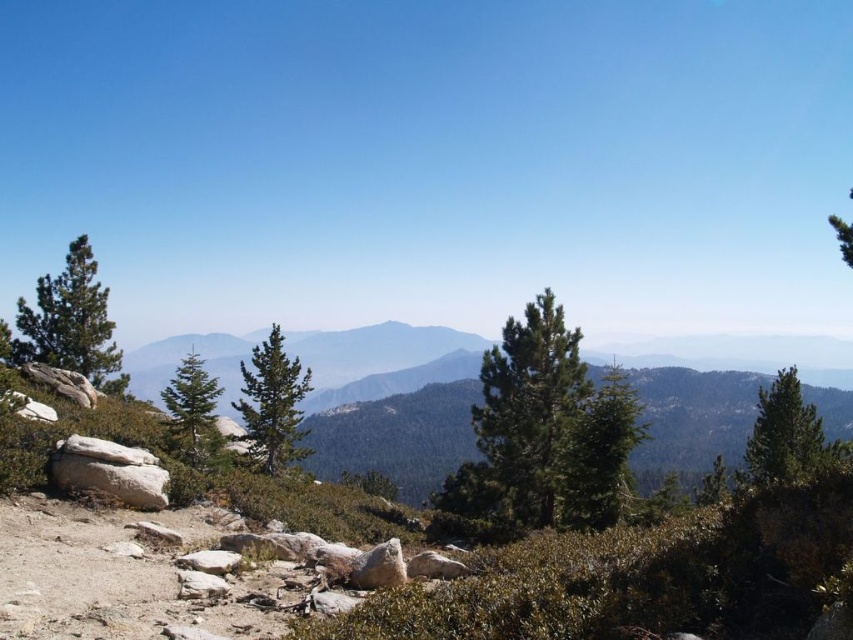
Question: Which object is farther from the camera taking this photo?

Choices:
 (A) green matte tree at left
 (B) green needle-like at left

Answer: (B)

Question: Can you confirm if green textured tree at right is bigger than green matte tree at left?

Choices:
 (A) no
 (B) yes

Answer: (B)

Question: Is green matte tree at left smaller than green textured tree at upper right?

Choices:
 (A) no
 (B) yes

Answer: (B)

Question: Which point is closer to the camera?

Choices:
 (A) (844, 257)
 (B) (769, 417)
 (C) (82, 369)

Answer: (A)

Question: From the image, what is the correct spatial relationship of green textured pine tree at center in relation to green matte tree at left?

Choices:
 (A) below
 (B) above

Answer: (A)

Question: Which object appears closest to the camera in this image?

Choices:
 (A) green needle-like at center
 (B) green textured tree at right

Answer: (B)